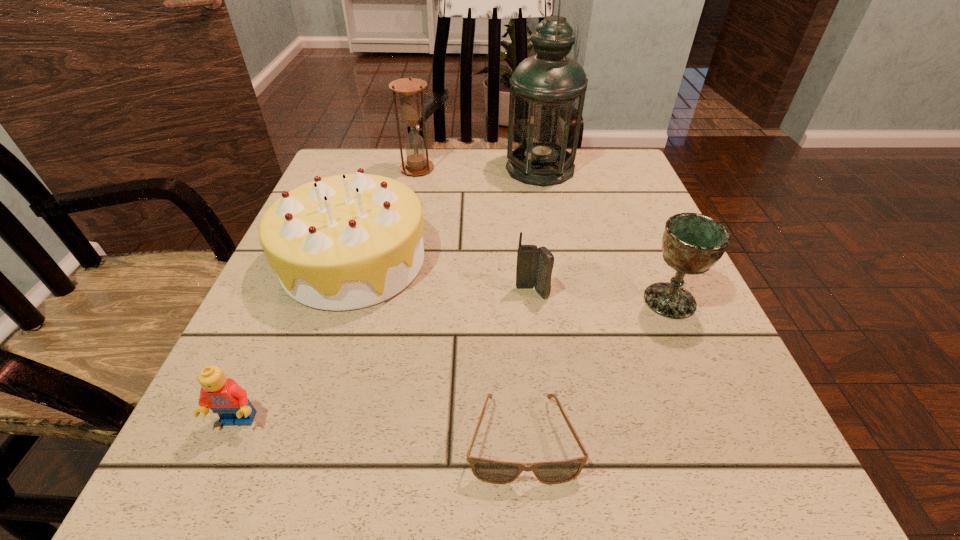
Find the location of a particular element. This screenshot has height=540, width=960. vacant space located 0.200m on the left of the chalice is located at coordinates (529, 301).

The width and height of the screenshot is (960, 540). I want to click on vacant space located on the keyboard of the cellular telephone, so click(x=540, y=356).

Where is `free space located 0.080m on the face of the Lego`? free space located 0.080m on the face of the Lego is located at coordinates (205, 495).

Image resolution: width=960 pixels, height=540 pixels. Find the location of `oil lamp present at the far edge`. oil lamp present at the far edge is located at coordinates (547, 93).

In order to click on hourglass located in the far edge section of the desktop in this screenshot , I will do `click(409, 89)`.

Identify the location of object that is positioned at the near edge. This screenshot has width=960, height=540. (491, 471).

This screenshot has width=960, height=540. What are the coordinates of `birthday cake located at the left edge` in the screenshot? It's located at coord(344,242).

In order to click on Lego located in the left edge section of the desktop in this screenshot , I will do `click(223, 396)`.

Image resolution: width=960 pixels, height=540 pixels. In order to click on oil lamp positioned at the right edge in this screenshot , I will do `click(547, 93)`.

This screenshot has height=540, width=960. Identify the location of chalice that is at the right edge. (692, 243).